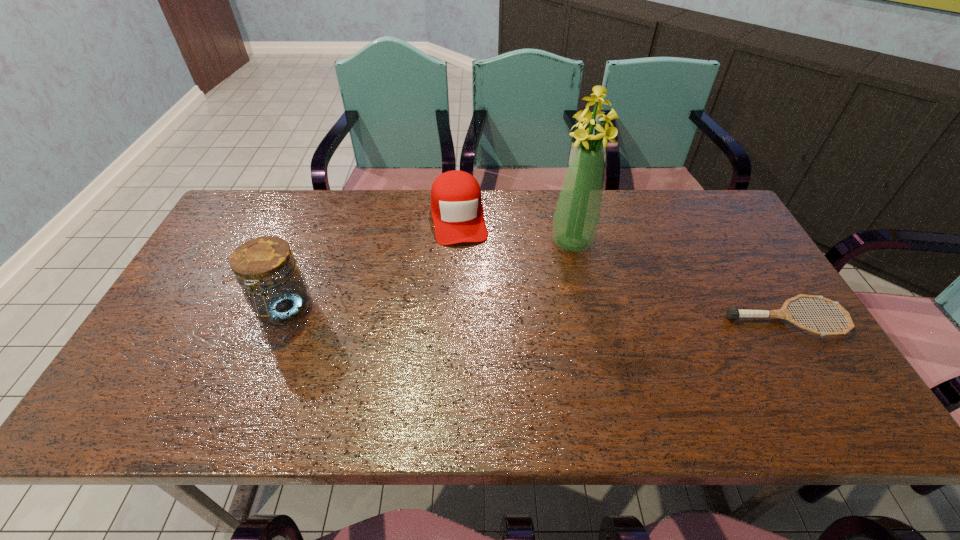
What are the coordinates of `free space located 0.090m on the front-facing side of the second object from right to left` in the screenshot? It's located at (566, 278).

This screenshot has width=960, height=540. I want to click on vacant space located 0.330m on the front-facing side of the second object from right to left, so click(x=555, y=348).

Where is `free location located 0.390m on the front-facing side of the second object from right to left`? Image resolution: width=960 pixels, height=540 pixels. free location located 0.390m on the front-facing side of the second object from right to left is located at coordinates (551, 369).

At what (x,y) coordinates should I click in order to perform the action: click on vacant position located on the front-facing side of the third tallest object. Please return your answer as a coordinate pair (x, y). Image resolution: width=960 pixels, height=540 pixels. Looking at the image, I should click on (464, 262).

At what (x,y) coordinates should I click in order to perform the action: click on vacant region located 0.140m on the front-facing side of the third tallest object. Please return your answer as a coordinate pair (x, y). This screenshot has width=960, height=540. Looking at the image, I should click on (467, 280).

Identify the location of blank space located on the front-facing side of the third tallest object. Image resolution: width=960 pixels, height=540 pixels. (478, 353).

Image resolution: width=960 pixels, height=540 pixels. Find the location of `bouquet that is at the far edge`. bouquet that is at the far edge is located at coordinates (576, 218).

The image size is (960, 540). What are the coordinates of `baseball cap that is at the far edge` in the screenshot? It's located at (456, 206).

The image size is (960, 540). What are the coordinates of `object located in the right edge section of the desktop` in the screenshot? It's located at (733, 313).

The width and height of the screenshot is (960, 540). In order to click on vacant space at the far edge in this screenshot , I will do `click(315, 204)`.